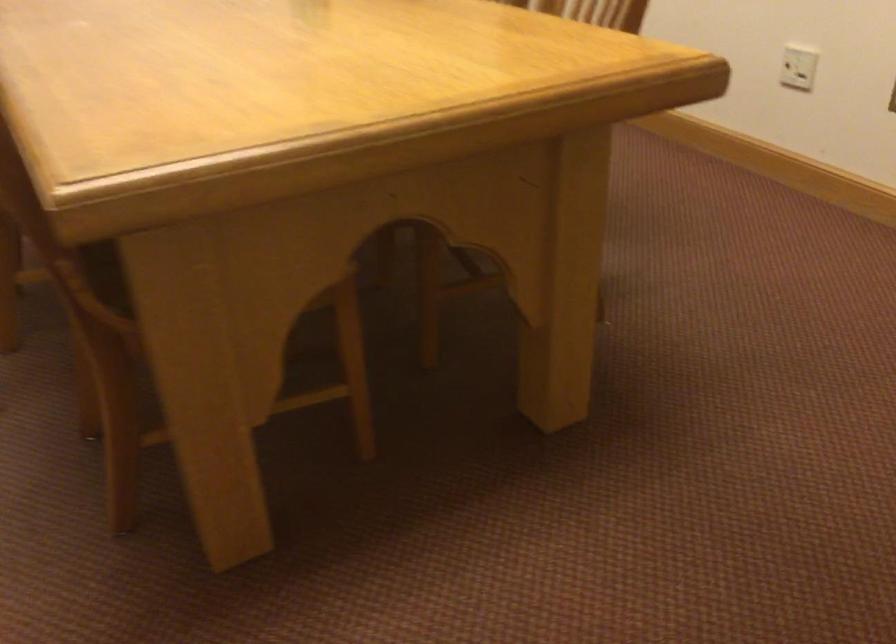
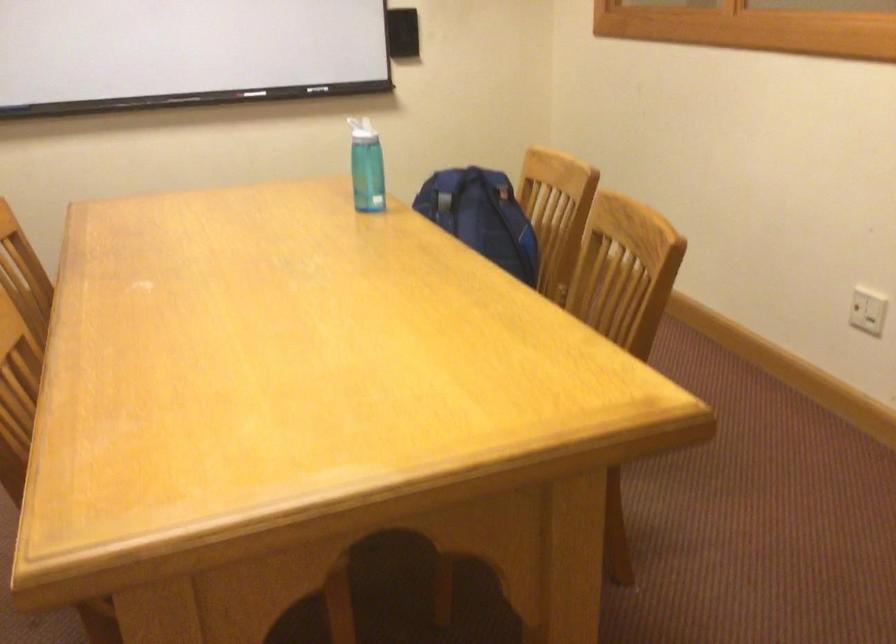
Question: The images are taken continuously from a first-person perspective. In which direction are you moving?

Choices:
 (A) Left
 (B) Right
 (C) Forward
 (D) Backward

Answer: (B)